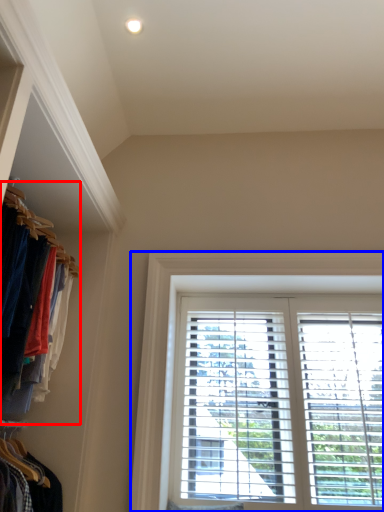
Question: Which point is closer to the camera, closet (highlighted by a red box) or window (highlighted by a blue box)?

Choices:
 (A) closet
 (B) window

Answer: (A)